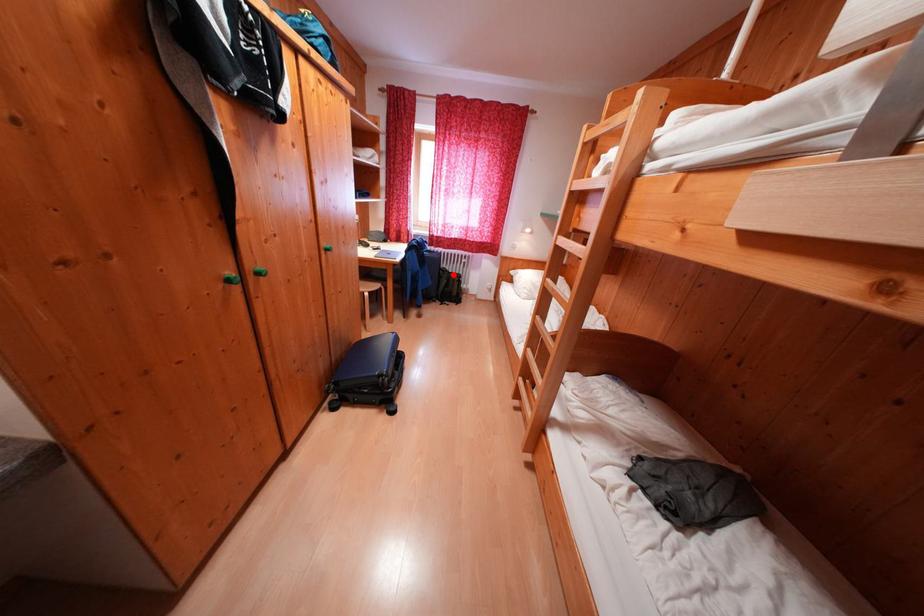
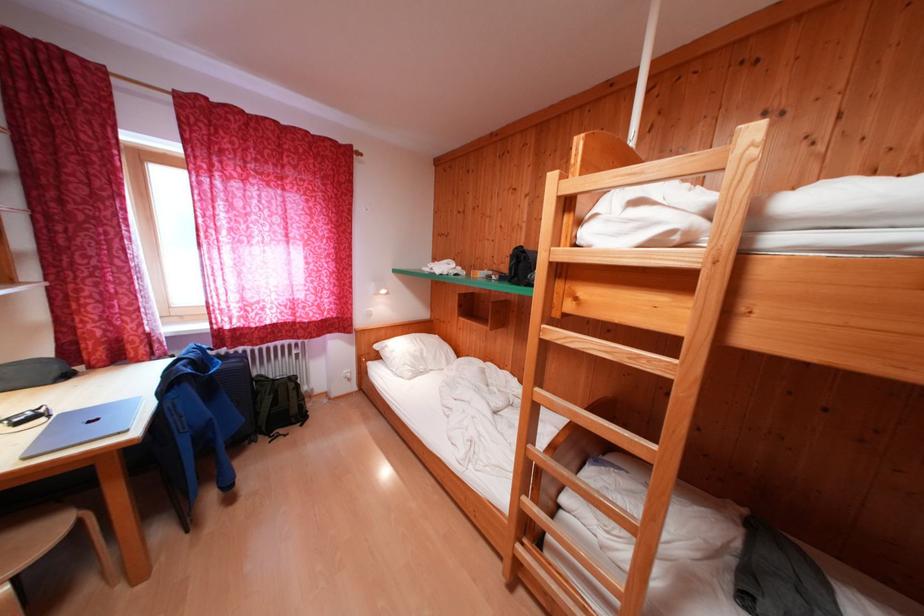
Question: I am providing you with two images of the same scene from different viewpoints. A red point is shown in image1. For the corresponding object point in image2, is it positioned nearer or farther from the camera?

Choices:
 (A) Nearer
 (B) Farther

Answer: (B)